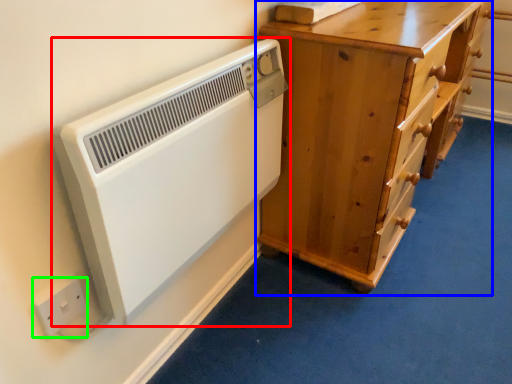
Question: Estimate the real-world distances between objects in this image. Which object is farther from home appliance (highlighted by a red box), chest of drawers (highlighted by a blue box) or electric outlet (highlighted by a green box)?

Choices:
 (A) chest of drawers
 (B) electric outlet

Answer: (A)